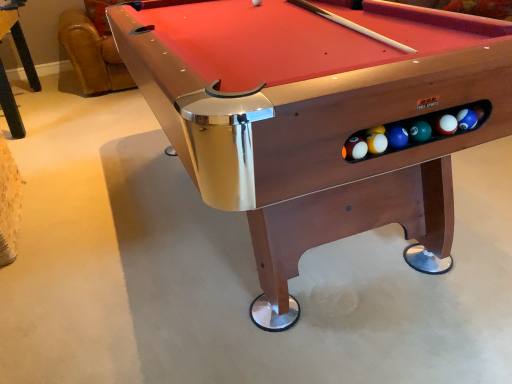
Question: Does wooden pool table at lower left have a lesser width compared to wooden billiard table at center?

Choices:
 (A) yes
 (B) no

Answer: (A)

Question: From the image's perspective, is wooden pool table at lower left on wooden billiard table at center?

Choices:
 (A) yes
 (B) no

Answer: (A)

Question: Is wooden pool table at lower left placed right next to wooden billiard table at center?

Choices:
 (A) no
 (B) yes

Answer: (A)

Question: Is wooden pool table at lower left further to camera compared to wooden billiard table at center?

Choices:
 (A) yes
 (B) no

Answer: (A)

Question: Is wooden pool table at lower left looking in the opposite direction of wooden billiard table at center?

Choices:
 (A) no
 (B) yes

Answer: (A)

Question: Considering the relative sizes of wooden pool table at lower left and wooden billiard table at center in the image provided, is wooden pool table at lower left bigger than wooden billiard table at center?

Choices:
 (A) yes
 (B) no

Answer: (B)

Question: Is the position of wooden billiard table at center less distant than that of wooden pool table at lower left?

Choices:
 (A) no
 (B) yes

Answer: (B)

Question: Is wooden billiard table at center facing away from wooden pool table at lower left?

Choices:
 (A) yes
 (B) no

Answer: (B)

Question: Can you confirm if wooden billiard table at center is smaller than wooden pool table at lower left?

Choices:
 (A) no
 (B) yes

Answer: (A)

Question: Does wooden billiard table at center appear on the left side of wooden pool table at lower left?

Choices:
 (A) no
 (B) yes

Answer: (A)

Question: Is wooden billiard table at center located outside wooden pool table at lower left?

Choices:
 (A) yes
 (B) no

Answer: (A)

Question: Is wooden pool table at lower left a part of wooden billiard table at center?

Choices:
 (A) no
 (B) yes

Answer: (A)

Question: Considering the positions of wooden billiard table at center and wooden pool table at lower left in the image, is wooden billiard table at center taller or shorter than wooden pool table at lower left?

Choices:
 (A) short
 (B) tall

Answer: (A)